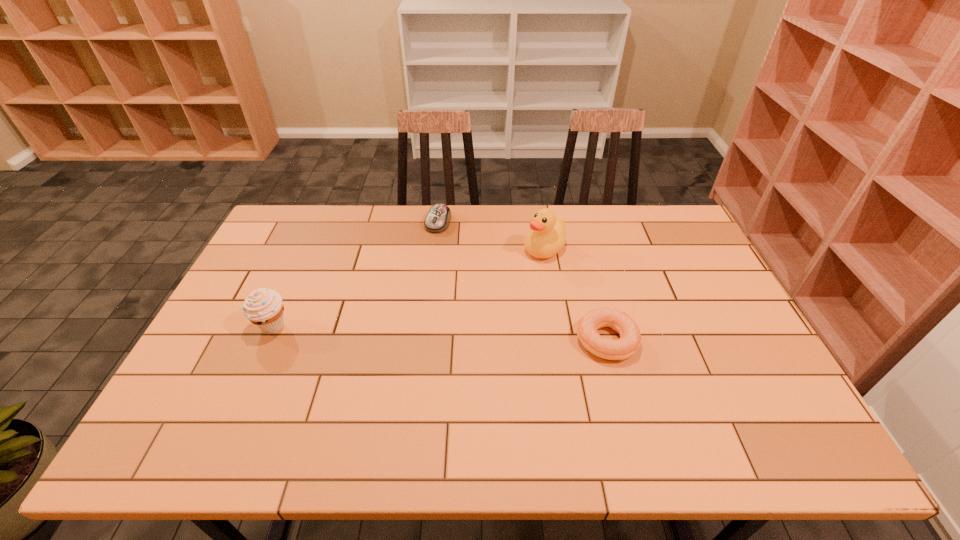
Where is `the second tallest object`? the second tallest object is located at coordinates (263, 307).

Locate an element on the screen. This screenshot has width=960, height=540. muffin is located at coordinates (263, 307).

The height and width of the screenshot is (540, 960). What are the coordinates of `bagel` in the screenshot? It's located at (630, 337).

Where is `the tallest object`? This screenshot has height=540, width=960. the tallest object is located at coordinates (547, 237).

Image resolution: width=960 pixels, height=540 pixels. What are the coordinates of `the third nearest object` in the screenshot? It's located at click(x=547, y=237).

Image resolution: width=960 pixels, height=540 pixels. I want to click on computer mouse, so click(x=437, y=220).

At what (x,y) coordinates should I click in order to perform the action: click on the third object from right to left. Please return your answer as a coordinate pair (x, y). The width and height of the screenshot is (960, 540). Looking at the image, I should click on (437, 220).

This screenshot has height=540, width=960. In order to click on free spot located 0.240m on the back of the muffin in this screenshot , I will do pyautogui.click(x=302, y=258).

What are the coordinates of `vacant space situated 0.080m on the left of the bagel` in the screenshot? It's located at (545, 340).

I want to click on free point located 0.120m at the beak of the tallest object, so click(503, 275).